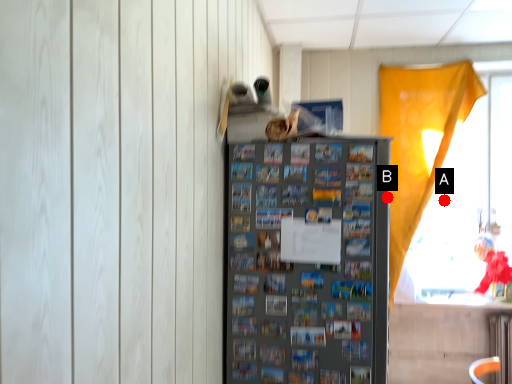
Question: Two points are circled on the image, labeled by A and B beside each circle. Which of the following is the farthest from the observer?

Choices:
 (A) A is further
 (B) B is further

Answer: (A)